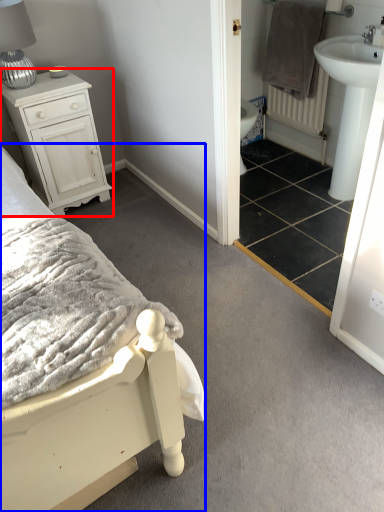
Question: Which object is further to the camera taking this photo, chest of drawers (highlighted by a red box) or bed (highlighted by a blue box)?

Choices:
 (A) chest of drawers
 (B) bed

Answer: (A)